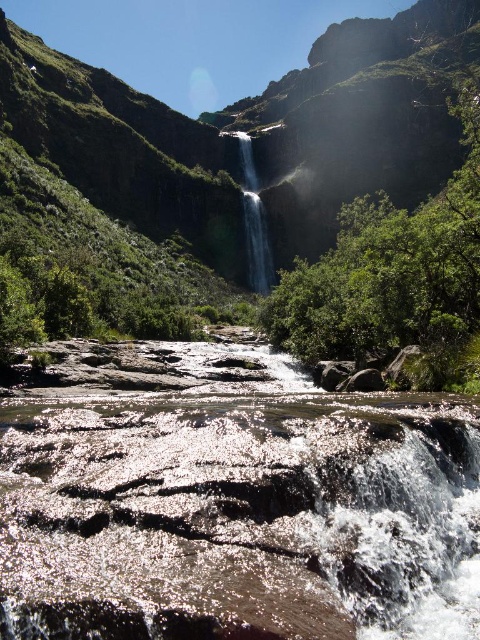
The width and height of the screenshot is (480, 640). What do you see at coordinates (236, 506) in the screenshot?
I see `shiny brown rock at center` at bounding box center [236, 506].

Which is in front, point (45, 545) or point (124, 192)?

Point (45, 545) is more forward.

Which is behind, point (120, 570) or point (197, 253)?

Positioned behind is point (197, 253).

Find the location of a particular element. The width and height of the screenshot is (480, 640). shiny brown rock at center is located at coordinates (236, 506).

Who is shorter, green mossy rock at center or clear glass waterfall at upper center?

With less height is clear glass waterfall at upper center.

Can you confirm if green mossy rock at center is positioned below clear glass waterfall at upper center?

No, green mossy rock at center is not below clear glass waterfall at upper center.

Find the location of `green mossy rock at center`. green mossy rock at center is located at coordinates (254, 132).

Which is below, shiny brown rock at center or clear glass waterfall at upper center?

shiny brown rock at center is lower down.

I want to click on shiny brown rock at center, so click(236, 506).

Is point (6, 550) positioned behind point (253, 260)?

No, (6, 550) is closer to viewer.

This screenshot has height=640, width=480. I want to click on shiny brown rock at center, so click(236, 506).